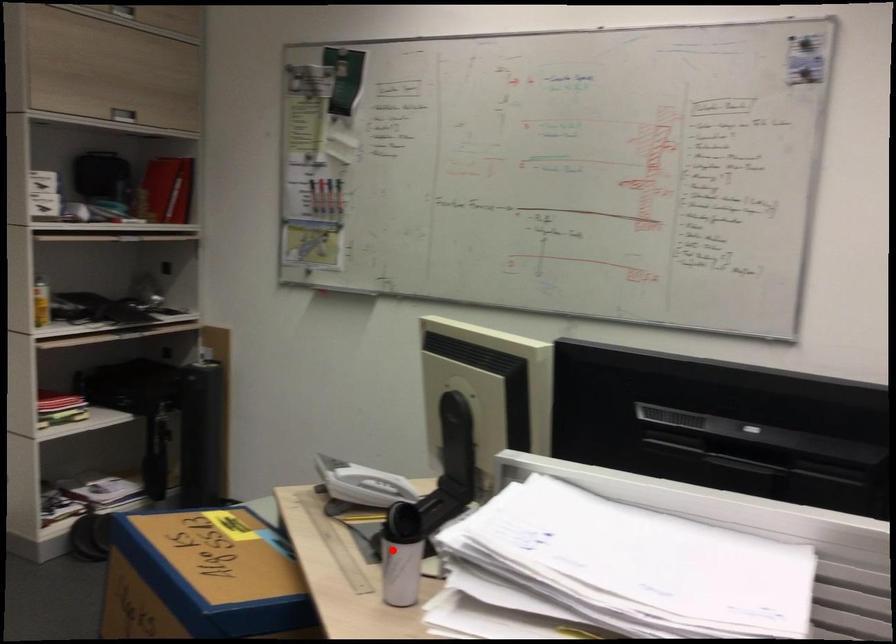
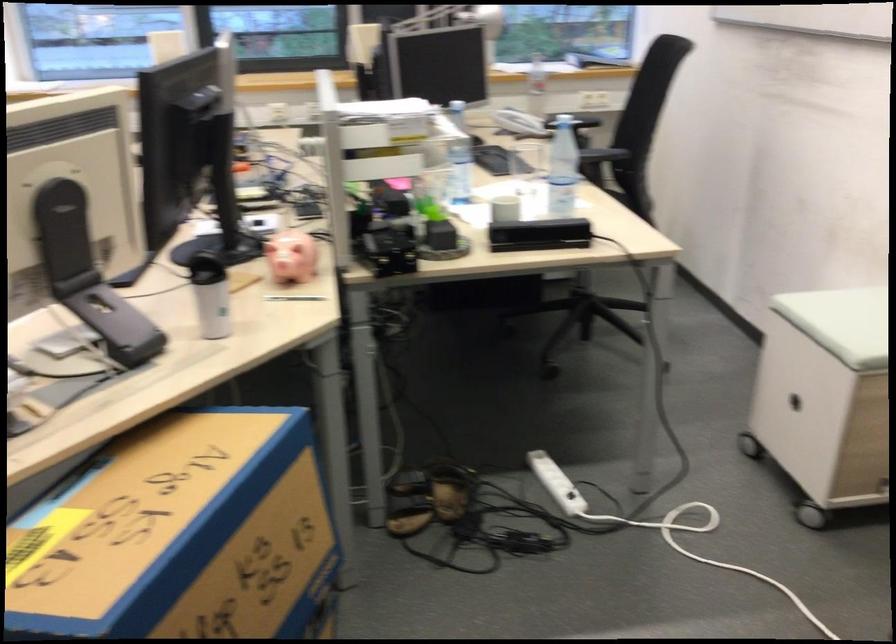
In the second image, find the point that corresponds to the highlighted location in the first image.

(211, 295)